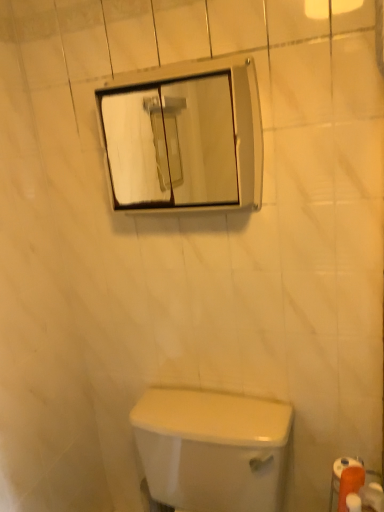
Question: Can you confirm if white glossy toilet at lower center is positioned to the left of white matte toilet paper at lower right, positioned as the 3th toilet paper in right-to-left order?

Choices:
 (A) yes
 (B) no

Answer: (A)

Question: Does white glossy toilet at lower center have a smaller size compared to white matte toilet paper at lower right, positioned as the 3th toilet paper in right-to-left order?

Choices:
 (A) yes
 (B) no

Answer: (B)

Question: Considering the relative sizes of white glossy toilet at lower center and white matte toilet paper at lower right, positioned as the 3th toilet paper in right-to-left order, in the image provided, is white glossy toilet at lower center taller than white matte toilet paper at lower right, positioned as the 3th toilet paper in right-to-left order,?

Choices:
 (A) yes
 (B) no

Answer: (A)

Question: Is white glossy toilet at lower center turned away from white matte toilet paper at lower right, the 1th toilet paper positioned from the left?

Choices:
 (A) yes
 (B) no

Answer: (B)

Question: Considering the relative sizes of white glossy toilet at lower center and white matte toilet paper at lower right, positioned as the 3th toilet paper in right-to-left order, in the image provided, is white glossy toilet at lower center wider than white matte toilet paper at lower right, positioned as the 3th toilet paper in right-to-left order,?

Choices:
 (A) no
 (B) yes

Answer: (B)

Question: Relative to white matte toilet paper at lower right, positioned as the 3th toilet paper in right-to-left order, is orange matte toilet paper at lower right, marked as the 3th toilet paper in a left-to-right arrangement, in front or behind?

Choices:
 (A) behind
 (B) front

Answer: (A)

Question: Is orange matte toilet paper at lower right, marked as the 3th toilet paper in a left-to-right arrangement, inside or outside of white matte toilet paper at lower right, the 1th toilet paper positioned from the left?

Choices:
 (A) inside
 (B) outside

Answer: (B)

Question: In terms of width, does orange matte toilet paper at lower right, marked as the 3th toilet paper in a left-to-right arrangement, look wider or thinner when compared to white matte toilet paper at lower right, the 1th toilet paper positioned from the left?

Choices:
 (A) wide
 (B) thin

Answer: (A)

Question: Is orange matte toilet paper at lower right, placed as the 1th toilet paper when sorted from right to left, taller or shorter than white matte toilet paper at lower right, positioned as the 3th toilet paper in right-to-left order?

Choices:
 (A) tall
 (B) short

Answer: (A)

Question: Is orange matte toilet paper at lower right, positioned as the 2th toilet paper in left-to-right order, situated inside clear glass mirror at upper center or outside?

Choices:
 (A) inside
 (B) outside

Answer: (B)

Question: From a real-world perspective, relative to clear glass mirror at upper center, is orange matte toilet paper at lower right, positioned as the 2th toilet paper in left-to-right order, vertically above or below?

Choices:
 (A) above
 (B) below

Answer: (B)

Question: Would you say orange matte toilet paper at lower right, positioned as the 2th toilet paper in left-to-right order, is to the left or to the right of clear glass mirror at upper center in the picture?

Choices:
 (A) right
 (B) left

Answer: (A)

Question: Is point (365, 474) positioned closer to the camera than point (170, 145)?

Choices:
 (A) closer
 (B) farther

Answer: (A)

Question: Is white glossy toilet at lower center wider or thinner than orange matte toilet paper at lower right, which is counted as the 2th toilet paper, starting from the right?

Choices:
 (A) thin
 (B) wide

Answer: (B)

Question: Considering the positions of white glossy toilet at lower center and orange matte toilet paper at lower right, which is counted as the 2th toilet paper, starting from the right, in the image, is white glossy toilet at lower center taller or shorter than orange matte toilet paper at lower right, which is counted as the 2th toilet paper, starting from the right,?

Choices:
 (A) short
 (B) tall

Answer: (B)